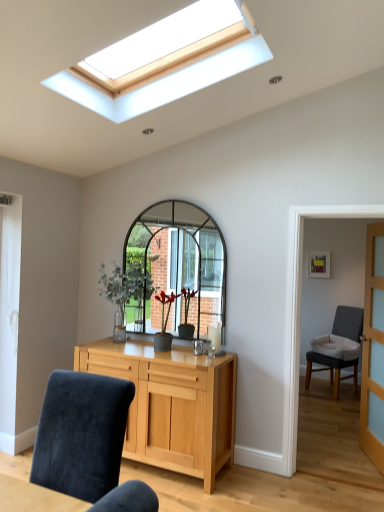
At what (x,y) coordinates should I click in order to perform the action: click on vacant space underneath matte gray vase at center (from a real-world perspective). Please return your answer as a coordinate pair (x, y). The height and width of the screenshot is (512, 384). Looking at the image, I should click on (162, 351).